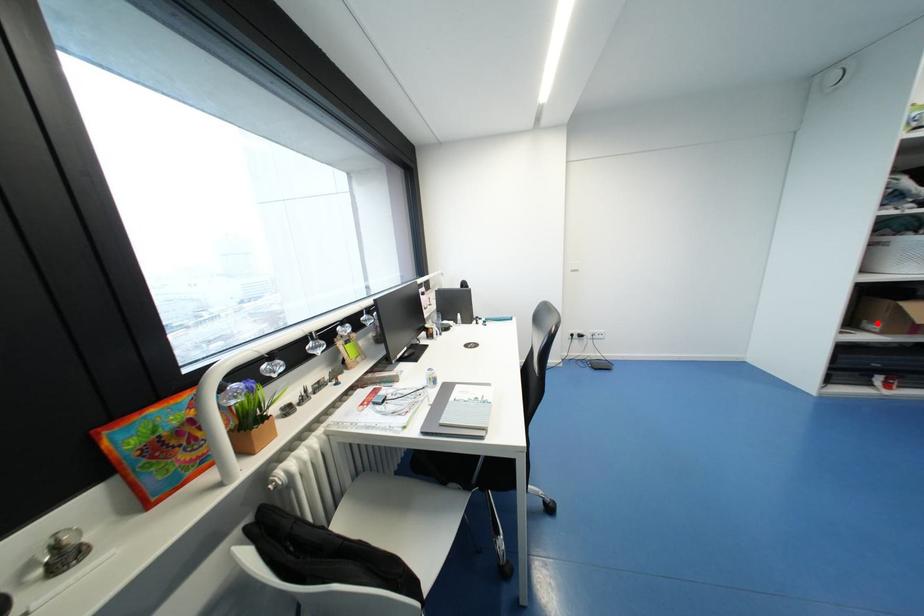
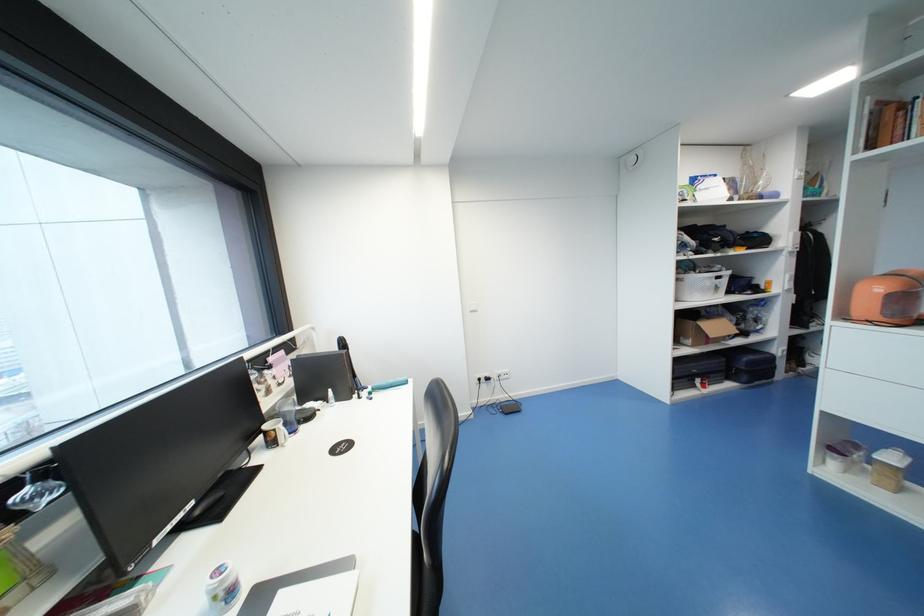
Question: I am providing you with two images of the same scene from different viewpoints. Image1 has a red point marked. In image2, the corresponding 3D location appears at what relative position? Reply with the corresponding letter.

Choices:
 (A) Closer
 (B) Farther

Answer: (B)